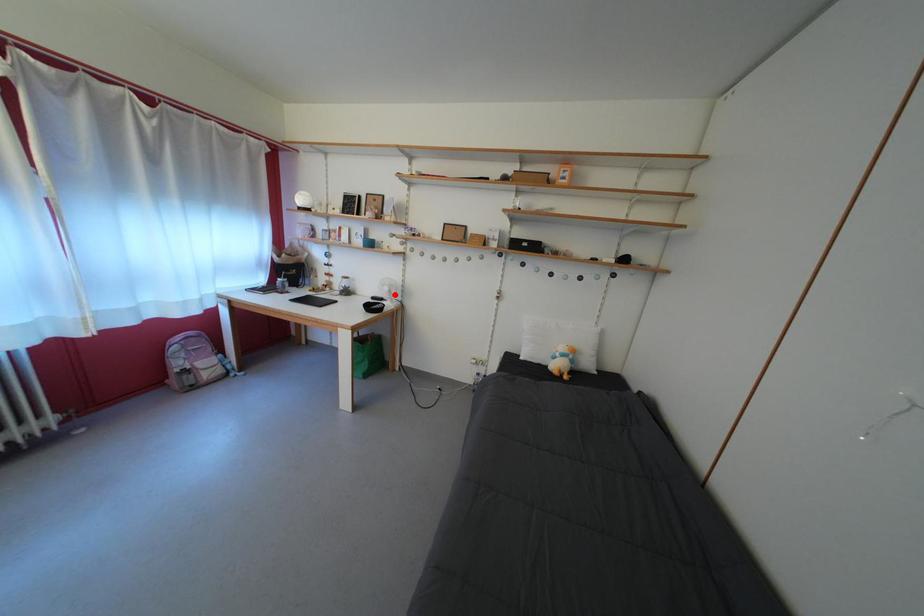
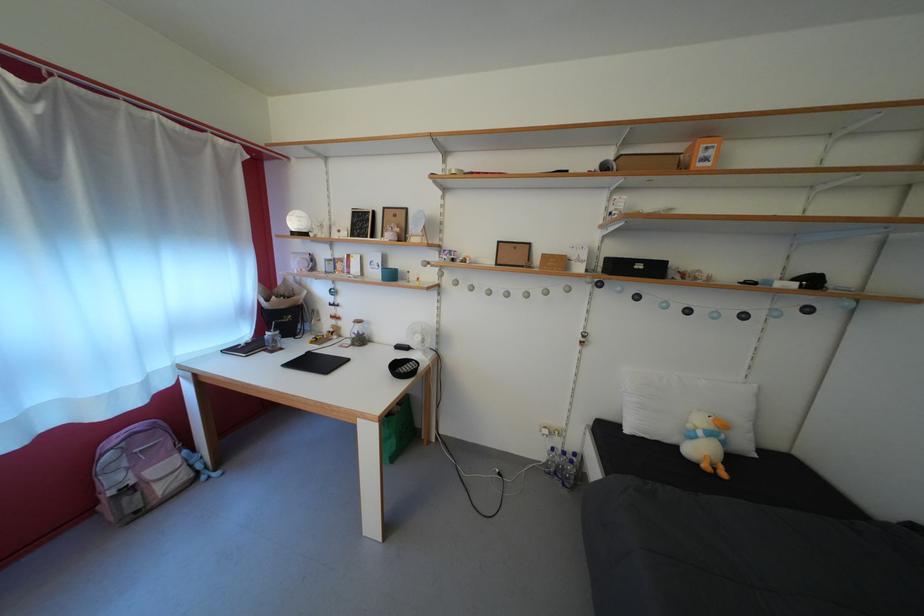
Question: I am providing you with two images of the same scene from different viewpoints. Image1 has a red point marked. In image2, the corresponding 3D location appears at what relative position? Reply with the corresponding letter.

Choices:
 (A) Closer
 (B) Farther

Answer: (B)